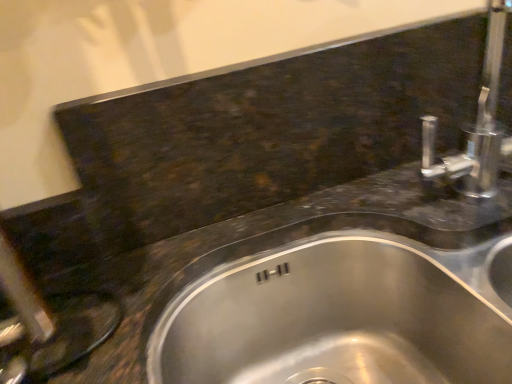
Describe the element at coordinates (342, 315) in the screenshot. This screenshot has height=384, width=512. I see `stainless steel sink at center` at that location.

Identify the location of stainless steel sink at center. (342, 315).

Find the location of a particular element. This screenshot has height=384, width=512. stainless steel sink at center is located at coordinates (342, 315).